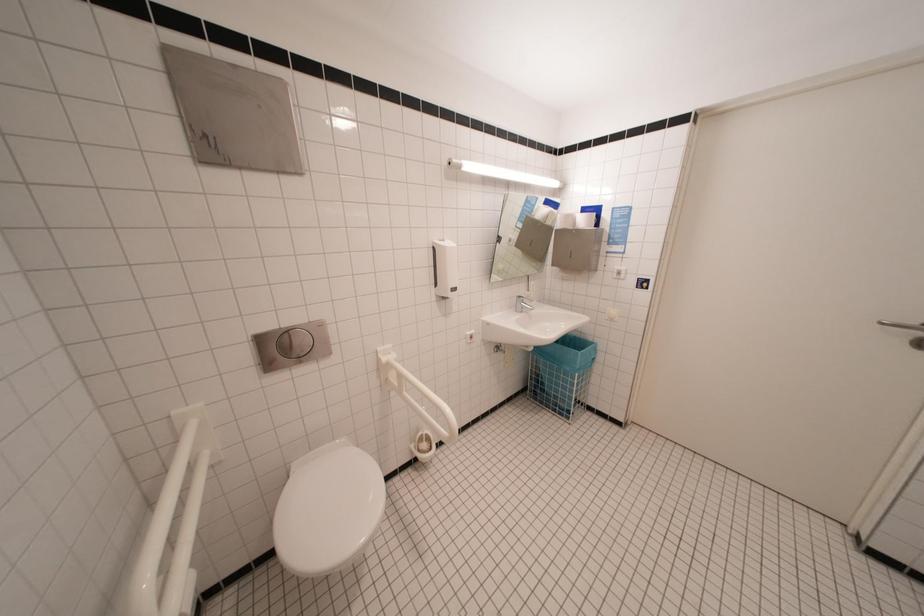
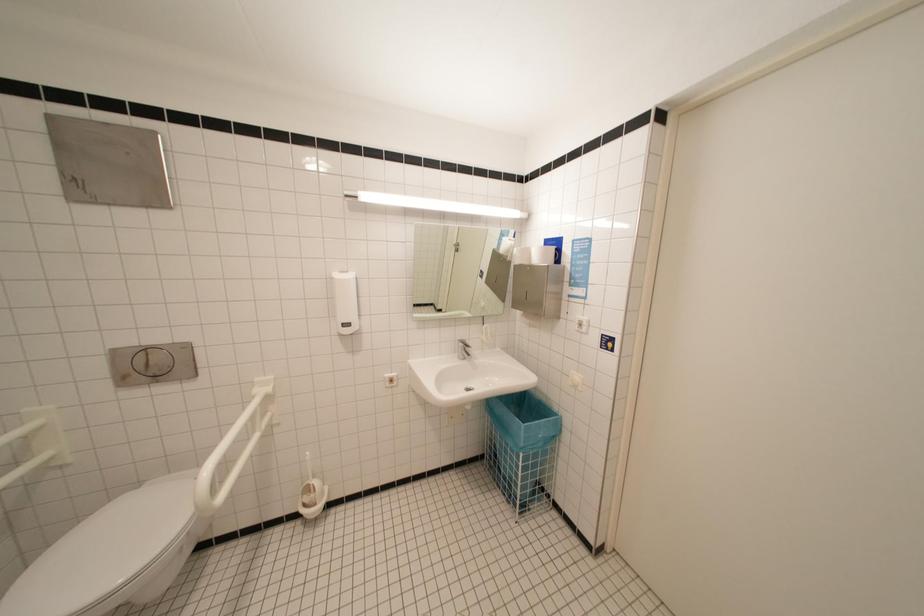
Question: Based on the continuous images, in which direction is the camera rotating? Reply with the corresponding letter.

Choices:
 (A) Left
 (B) Right
 (C) Up
 (D) Down

Answer: (A)